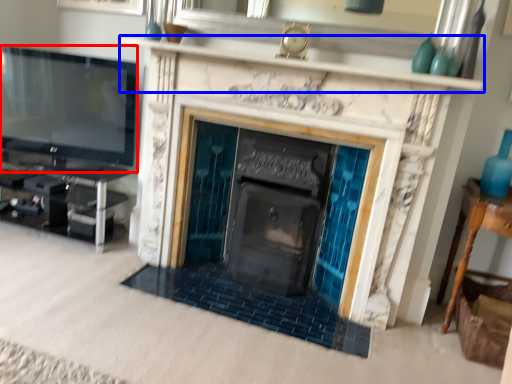
Question: Which object is closer to the camera taking this photo, television (highlighted by a red box) or mantle (highlighted by a blue box)?

Choices:
 (A) television
 (B) mantle

Answer: (B)